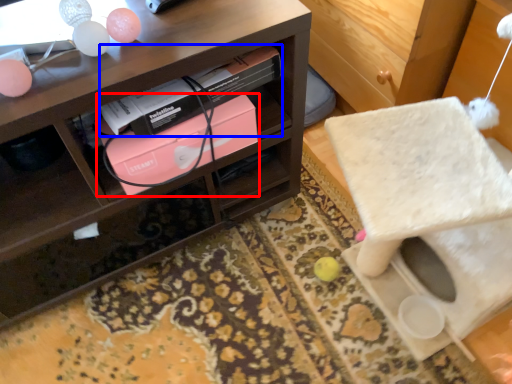
Question: Among these objects, which one is nearest to the camera, box (highlighted by a red box) or book (highlighted by a blue box)?

Choices:
 (A) box
 (B) book

Answer: (B)